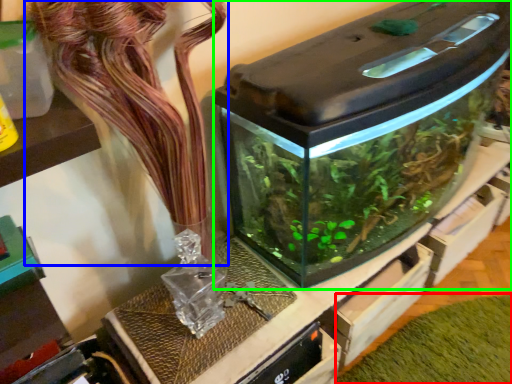
Question: Which is nearer to the plant (highlighted by a red box)? flower (highlighted by a blue box) or water tank (highlighted by a green box).

Choices:
 (A) flower
 (B) water tank

Answer: (B)